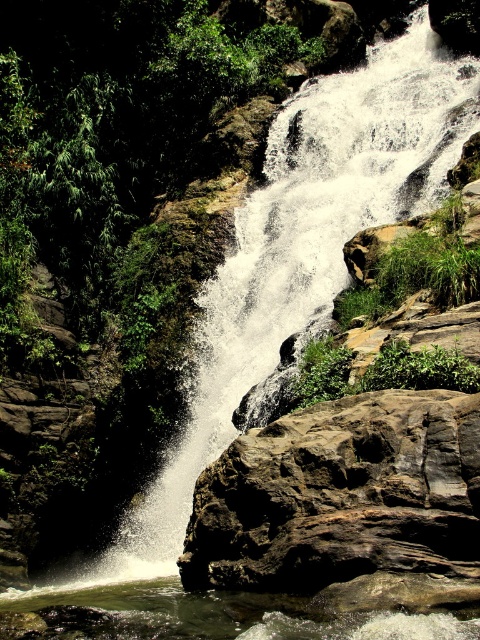
You are a hiker standing at the edge of the waterfall. You see a point marked at coordinates point [340,496]. According to the image, what type of rock is located at that point?

The point [340,496] indicates a brown rough rock at center.

You are a hiker trying to cross the waterfall area. You see the brown rough rock at center and the clear water at bottom center. Which one is higher and safer to step on?

The brown rough rock at center has a greater height compared to the clear water at bottom center, so stepping on the brown rough rock at center would be higher and safer.

You are standing at the base of the waterfall and want to take a photo of two points on the cliff face. The first point is labeled as point (454,516) and the second is point (436,618). Which point should you focus on first if you want to capture the one closer to you?

You should focus on point (436,618) first because it is closer to you than point (454,516), which is further away.